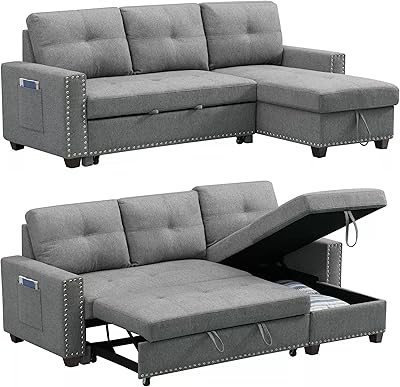
At what (x,y) coordinates should I click in order to perform the action: click on book. Please return your answer as a coordinate pair (x, y). Looking at the image, I should click on (31, 281), (32, 82).